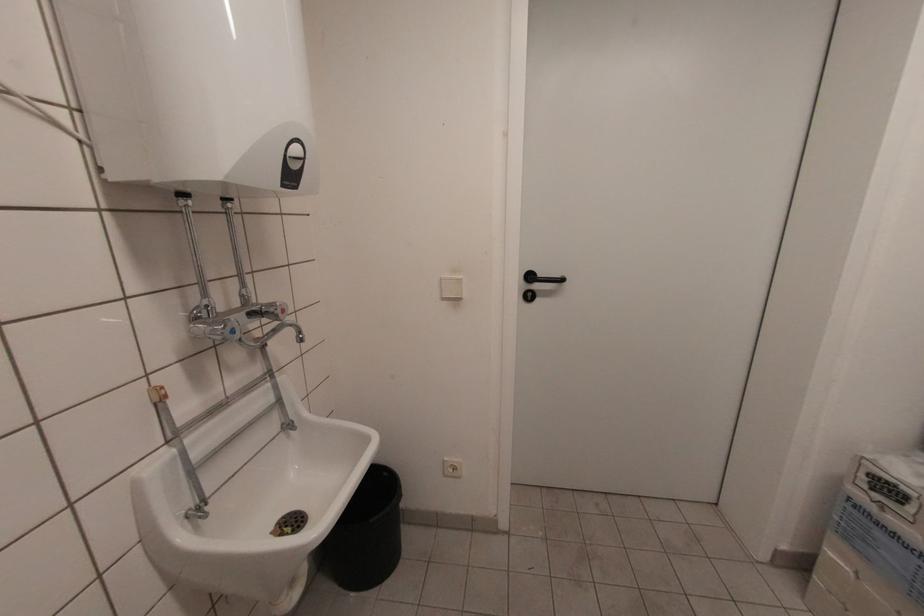
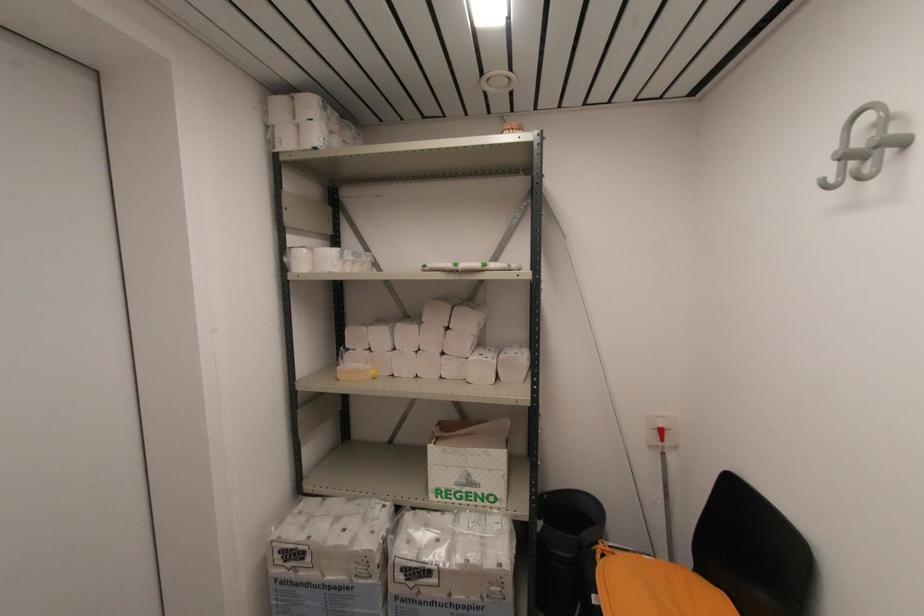
Find the pixel in the second image that matches (869,476) in the first image.

(281, 553)